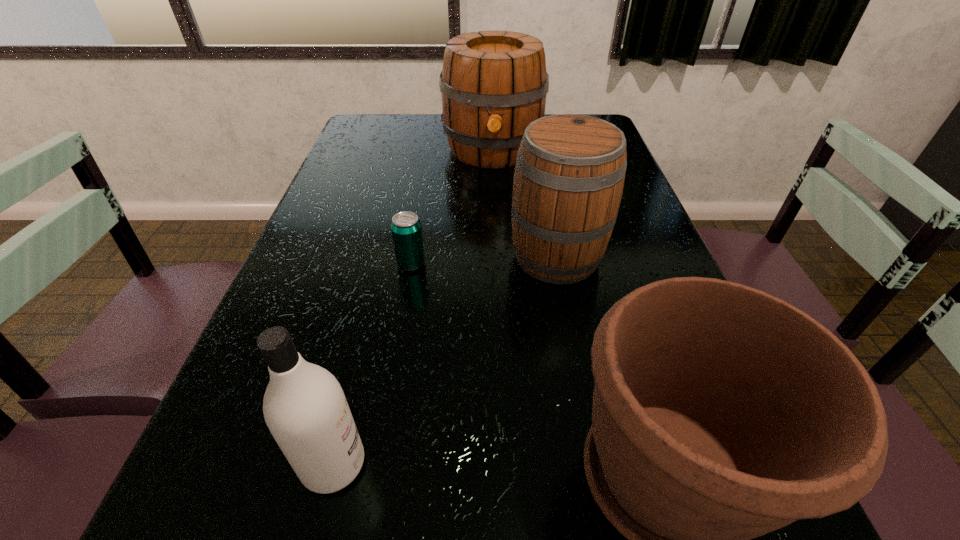
I want to click on object that is positioned at the right edge, so click(570, 169).

The height and width of the screenshot is (540, 960). I want to click on free space at the left edge of the desktop, so click(368, 164).

In the image, there is a desktop. At what (x,y) coordinates should I click in order to perform the action: click on vacant space at the right edge. Please return your answer as a coordinate pair (x, y). The width and height of the screenshot is (960, 540). Looking at the image, I should click on (613, 281).

This screenshot has height=540, width=960. I want to click on vacant space at the far left corner, so click(358, 141).

I want to click on free point between the farthest object and the shampoo, so (x=413, y=307).

Where is `vacant region between the beer can and the farthest object`? This screenshot has width=960, height=540. vacant region between the beer can and the farthest object is located at coordinates (452, 206).

Locate an element on the screen. free spot between the shampoo and the farther cider is located at coordinates (413, 307).

What are the coordinates of `empty space between the shortest object and the shampoo` in the screenshot? It's located at (372, 364).

At what (x,y) coordinates should I click in order to perform the action: click on free spot between the beer can and the shampoo. Please return your answer as a coordinate pair (x, y). The width and height of the screenshot is (960, 540). Looking at the image, I should click on (372, 364).

Where is `object that is the fourth closest one to the flowerpot`? This screenshot has height=540, width=960. object that is the fourth closest one to the flowerpot is located at coordinates (493, 83).